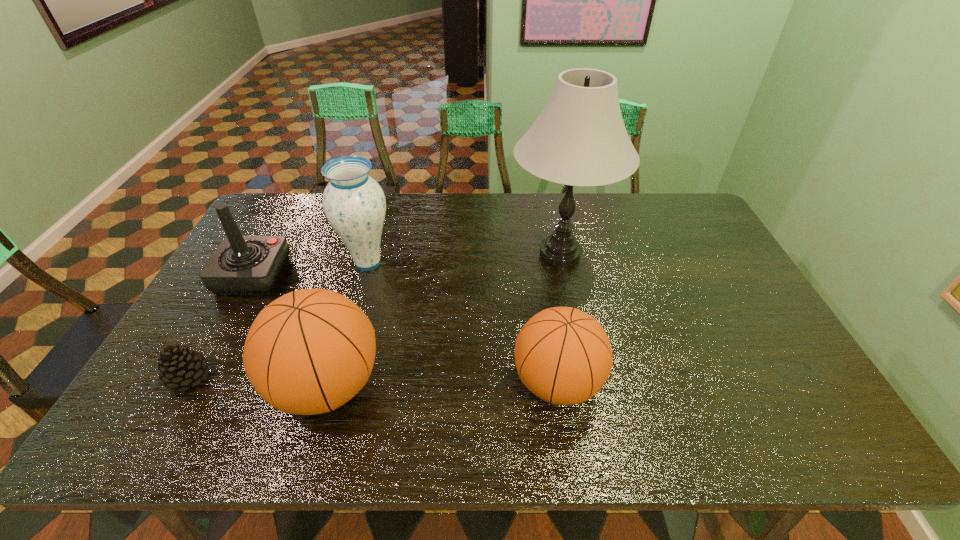
The basketballs are evenly distributed in the image. To maintain this, where would you place another basketball on the right? Please point to a free space. Please provide its 2D coordinates. Your answer should be formatted as a tuple, i.e. [(x, y)], where the tuple contains the x and y coordinates of a point satisfying the conditions above.

[(784, 380)]